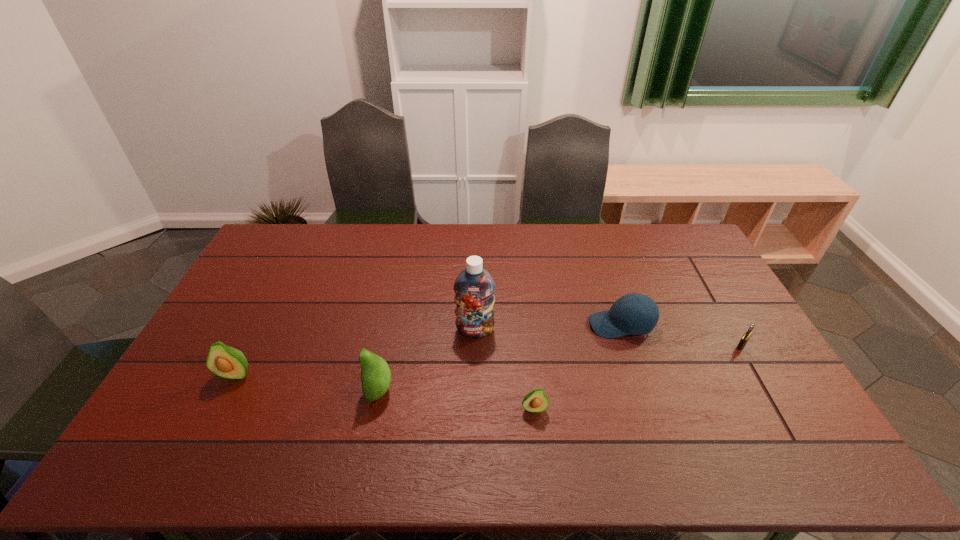
Please point out where to position a new avocado on the right to maintain spacing. Please provide its 2D coordinates. Your answer should be formatted as a tuple, i.e. [(x, y)], where the tuple contains the x and y coordinates of a point satisfying the conditions above.

[(700, 428)]